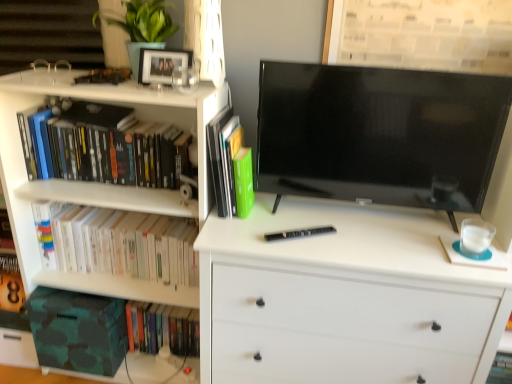
Question: Considering the positions of point (75, 319) and point (227, 165), is point (75, 319) closer or farther from the camera than point (227, 165)?

Choices:
 (A) closer
 (B) farther

Answer: (B)

Question: Considering the positions of camouflage fabric storage box at lower left and green matte book at center, which is the third book from bottom to top, in the image, is camouflage fabric storage box at lower left wider or thinner than green matte book at center, which is the third book from bottom to top,?

Choices:
 (A) wide
 (B) thin

Answer: (A)

Question: Which object is positioned closest to the matte black picture frame at upper center?

Choices:
 (A) white matte chest of drawers at center
 (B) white paperbacks at left, the 3th book in the top-to-bottom sequence
 (C) hardcover books at left, the 4th book positioned from the bottom
 (D) black glossy tv at center
 (E) camouflage fabric storage box at lower left

Answer: (C)

Question: Which object is the farthest from the black matte pen at center?

Choices:
 (A) black glossy tv at center
 (B) hardcover books at left, which is the 1th book from top to bottom
 (C) white matte chest of drawers at center
 (D) green matte book at center, which is the third book from bottom to top
 (E) white paperbacks at left, the 3th book in the top-to-bottom sequence

Answer: (B)